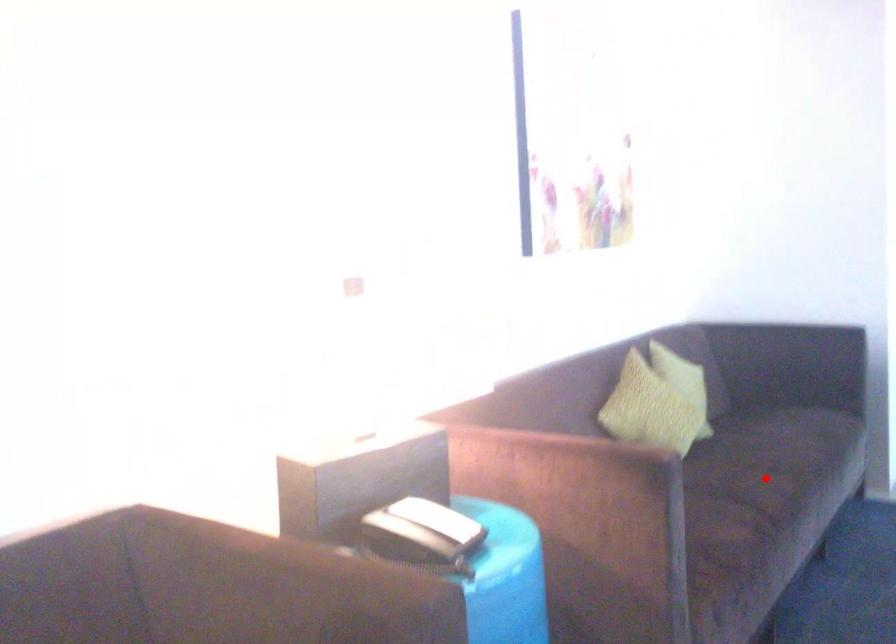
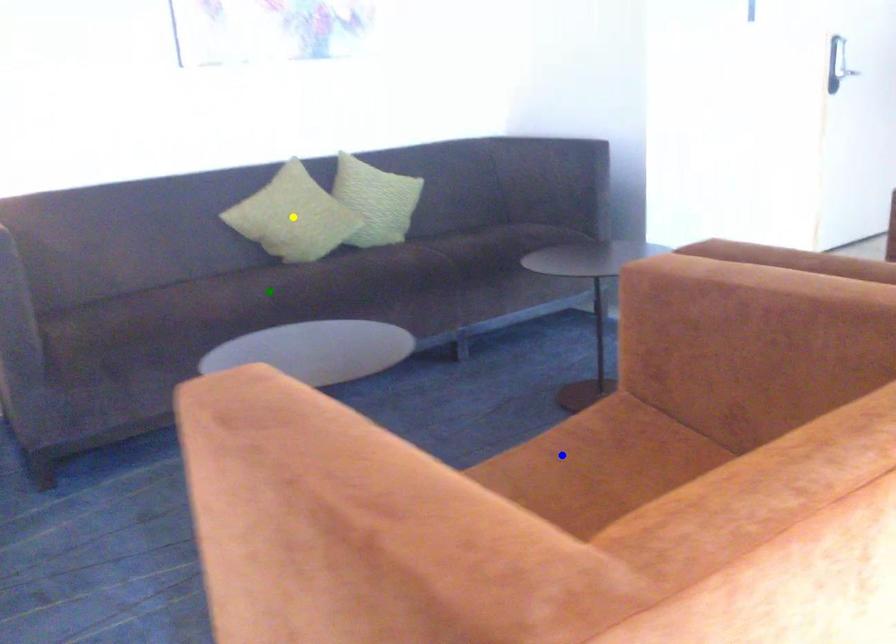
Question: I am providing you with two images of the same scene from different viewpoints. A red point is marked on the first image. You are given multiple points on the second image. Which point in image 2 is actually the same real-world point as the red point in image 1?

Choices:
 (A) blue point
 (B) green point
 (C) yellow point

Answer: (B)